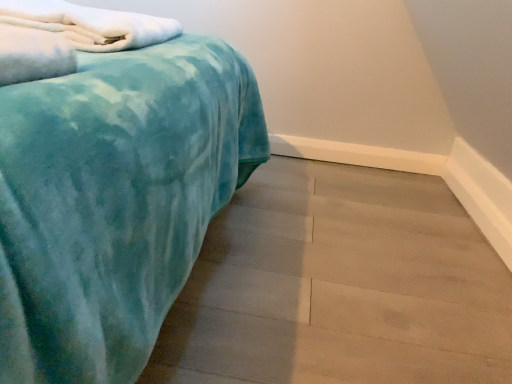
Measure the distance between point (112, 11) and camera.

The distance of point (112, 11) from camera is 3.94 feet.

I want to click on white fluffy towel at upper left, so click(90, 24).

Image resolution: width=512 pixels, height=384 pixels. What do you see at coordinates (90, 24) in the screenshot? I see `white fluffy towel at upper left` at bounding box center [90, 24].

What are the coordinates of `white fluffy towel at upper left` in the screenshot? It's located at (90, 24).